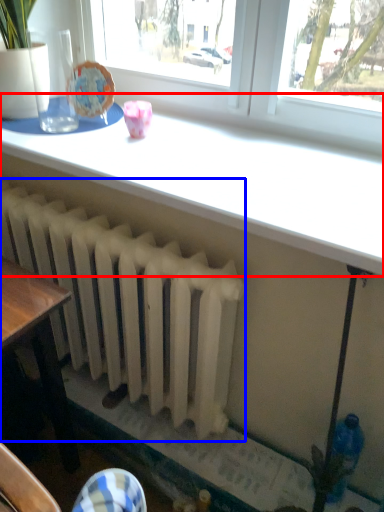
Question: Which of the following is the farthest to the observer, table (highlighted by a red box) or radiator (highlighted by a blue box)?

Choices:
 (A) table
 (B) radiator

Answer: (B)